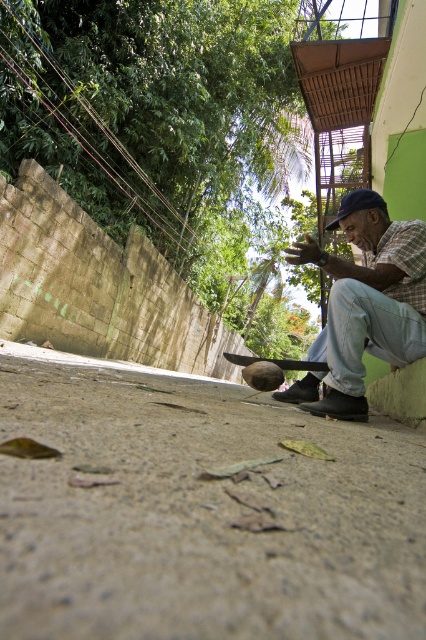
Question: Which object appears closest to the camera in this image?

Choices:
 (A) dark blue fabric baseball cap at center
 (B) light blue denim jeans at lower right

Answer: (B)

Question: Which point is farther to the camera?

Choices:
 (A) (141, 371)
 (B) (371, 204)
 (C) (408, 250)

Answer: (A)

Question: Can you confirm if gray concrete pavement at lower center is positioned below light blue denim jeans at lower right?

Choices:
 (A) yes
 (B) no

Answer: (A)

Question: Does gray concrete pavement at lower center have a lesser width compared to dark blue fabric baseball cap at center?

Choices:
 (A) no
 (B) yes

Answer: (A)

Question: Does light blue denim jeans at lower right come behind dark blue fabric baseball cap at center?

Choices:
 (A) no
 (B) yes

Answer: (A)

Question: Which object is the closest to the gray concrete pavement at lower center?

Choices:
 (A) light blue denim jeans at lower right
 (B) dark blue fabric baseball cap at center

Answer: (A)